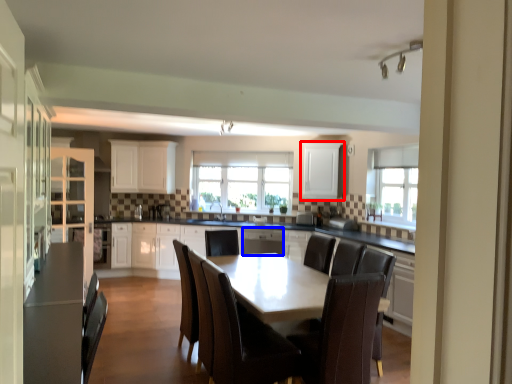
Question: Which of the following is the farthest to the observer, cabinetry (highlighted by a red box) or dish washer (highlighted by a blue box)?

Choices:
 (A) cabinetry
 (B) dish washer

Answer: (A)